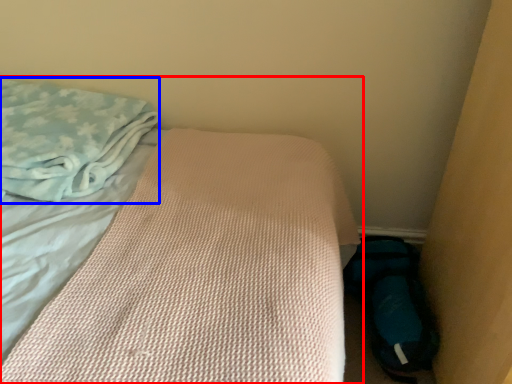
Question: Which of the following is the farthest to the observer, bed (highlighted by a red box) or cloth (highlighted by a blue box)?

Choices:
 (A) bed
 (B) cloth

Answer: (B)